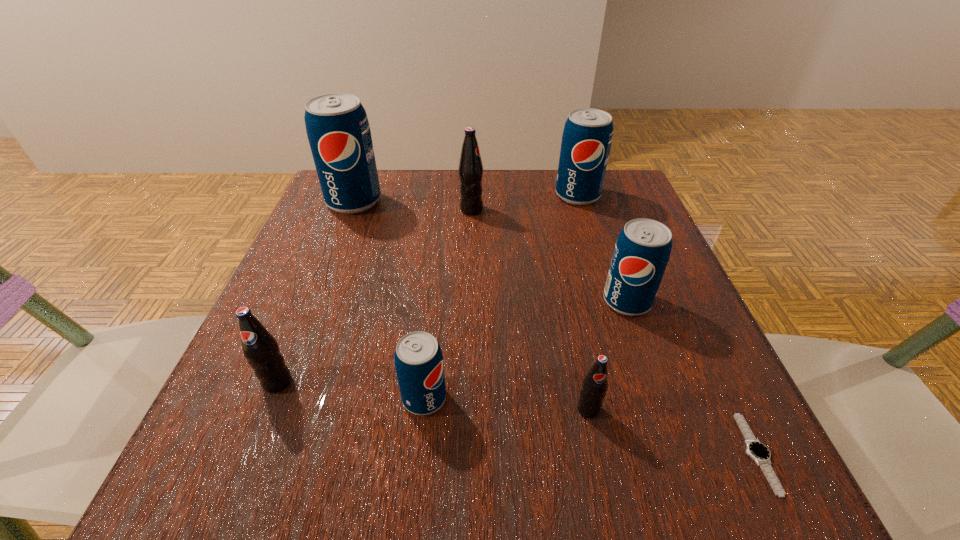
Locate an element on the screen. This screenshot has width=960, height=540. vacant area that lies between the second biggest blue pop and the third pop from right to left is located at coordinates (583, 302).

This screenshot has width=960, height=540. What are the coordinates of `empty space that is in between the fifth object from left to right and the fourth farthest object` in the screenshot? It's located at (608, 355).

Identify the location of the seventh closest object to the farthest black pop. (760, 453).

Where is `object that stands as the sixth closest to the rightmost object`? object that stands as the sixth closest to the rightmost object is located at coordinates (260, 348).

In order to click on pop that stands as the second closest to the leftmost black pop in this screenshot , I will do `click(338, 131)`.

Select which pop is the closest to the leftmost black pop. Please provide its 2D coordinates. Your answer should be formatted as a tuple, i.e. [(x, y)], where the tuple contains the x and y coordinates of a point satisfying the conditions above.

[(418, 358)]

I want to click on blue pop that can be found as the second closest to the third object from left to right, so click(338, 131).

I want to click on blue pop that is the fourth closest to the fourth pop from left to right, so tap(418, 358).

At what (x,y) coordinates should I click in order to perform the action: click on the second closest black pop to the rightmost object. Please return your answer as a coordinate pair (x, y). Looking at the image, I should click on (470, 170).

You are a GUI agent. You are given a task and a screenshot of the screen. Output one action in this format:
    pyautogui.click(x=<x>, y=<y>)
    Task: Click on the black pop that stands as the closest to the rightmost black pop
    
    Given the screenshot: What is the action you would take?
    pyautogui.click(x=260, y=348)